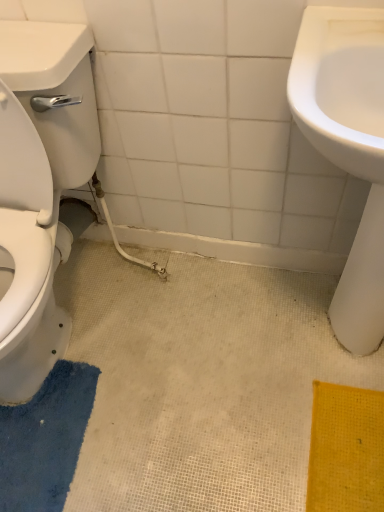
In the scene shown: Measure the distance between white glossy toilet at left and camera.

white glossy toilet at left is 32.58 inches from camera.

Find the location of a particular element. The image size is (384, 512). white glossy sink at right is located at coordinates (348, 147).

Where is `blue textured bath mat at lower left`? blue textured bath mat at lower left is located at coordinates (45, 439).

Where is `white glossy toilet at left`? white glossy toilet at left is located at coordinates (47, 196).

Considering the relative sizes of white glossy toilet at left and white glossy sink at right in the image provided, is white glossy toilet at left bigger than white glossy sink at right?

Correct, white glossy toilet at left is larger in size than white glossy sink at right.

What's the angular difference between white glossy toilet at left and white glossy sink at right's facing directions?

The angle between the facing direction of white glossy toilet at left and the facing direction of white glossy sink at right is 0.386 degrees.

Is the position of white glossy toilet at left more distant than that of white glossy sink at right?

That is False.

From a real-world perspective, relative to white glossy sink at right, is white glossy toilet at left vertically above or below?

white glossy toilet at left is situated higher than white glossy sink at right in the real world.

Is the surface of white glossy toilet at left in direct contact with blue textured bath mat at lower left?

No, white glossy toilet at left is not in contact with blue textured bath mat at lower left.

Where is `bath mat on the right of the white glossy toilet at left`? The height and width of the screenshot is (512, 384). bath mat on the right of the white glossy toilet at left is located at coordinates (45, 439).

In the scene shown: How far apart are white glossy toilet at left and blue textured bath mat at lower left?

white glossy toilet at left and blue textured bath mat at lower left are 12.08 inches apart.

Is white glossy toilet at left positioned beyond the bounds of blue textured bath mat at lower left?

white glossy toilet at left is positioned outside blue textured bath mat at lower left.

Would you say white glossy toilet at left is part of white glossy sink at right's contents?

No.

Which is nearer, (382, 290) or (77, 104)?

Point (77, 104)

Does white glossy sink at right appear on the right side of white glossy toilet at left?

Yes, white glossy sink at right is to the right of white glossy toilet at left.

Between point (53, 429) and point (320, 65), which one is positioned behind?

Positioned behind is point (53, 429).

Is blue textured bath mat at lower left oriented away from white glossy sink at right?

No, blue textured bath mat at lower left is not facing the opposite direction of white glossy sink at right.

Where is `bath mat that is below the white glossy sink at right (from the image's perspective)`? This screenshot has height=512, width=384. bath mat that is below the white glossy sink at right (from the image's perspective) is located at coordinates (45, 439).

Based on the photo, is blue textured bath mat at lower left far away from white glossy sink at right?

That's not correct — blue textured bath mat at lower left is a little close to white glossy sink at right.

From the image's perspective, which is below, blue textured bath mat at lower left or white glossy toilet at left?

blue textured bath mat at lower left, from the image's perspective.

Consider the image. What's the angular difference between blue textured bath mat at lower left and white glossy toilet at left's facing directions?

6.98 degrees separate the facing orientations of blue textured bath mat at lower left and white glossy toilet at left.

Is blue textured bath mat at lower left oriented away from white glossy toilet at left?

No, blue textured bath mat at lower left's orientation is not away from white glossy toilet at left.

Can you see blue textured bath mat at lower left touching white glossy toilet at left?

No, blue textured bath mat at lower left is not next to white glossy toilet at left.

Consider the image. Is white glossy sink at right oriented away from blue textured bath mat at lower left?

No, white glossy sink at right is not facing the opposite direction of blue textured bath mat at lower left.

Locate an element on the screen. This screenshot has width=384, height=512. sink above the blue textured bath mat at lower left (from a real-world perspective) is located at coordinates (348, 147).

In the scene shown: Based on their positions, is white glossy sink at right located to the left or right of blue textured bath mat at lower left?

Clearly, white glossy sink at right is on the right of blue textured bath mat at lower left in the image.

Locate an element on the screen. sink to the right of white glossy toilet at left is located at coordinates (348, 147).

Where is `bath mat below the white glossy toilet at left (from the image's perspective)`? The image size is (384, 512). bath mat below the white glossy toilet at left (from the image's perspective) is located at coordinates (45, 439).

From the image, which object appears to be nearer to blue textured bath mat at lower left, white glossy sink at right or white glossy toilet at left?

The object closer to blue textured bath mat at lower left is white glossy toilet at left.

Looking at the image, which one is located further to white glossy sink at right, blue textured bath mat at lower left or white glossy toilet at left?

blue textured bath mat at lower left lies further to white glossy sink at right than the other object.

Based on their spatial positions, is white glossy toilet at left or white glossy sink at right closer to blue textured bath mat at lower left?

white glossy toilet at left is positioned closer to the anchor blue textured bath mat at lower left.

When comparing their distances from white glossy sink at right, does white glossy toilet at left or blue textured bath mat at lower left seem closer?

The object closer to white glossy sink at right is white glossy toilet at left.

From the image, which object appears to be nearer to white glossy toilet at left, white glossy sink at right or blue textured bath mat at lower left?

blue textured bath mat at lower left is positioned closer to the anchor white glossy toilet at left.

Looking at the image, which one is located closer to white glossy toilet at left, blue textured bath mat at lower left or white glossy sink at right?

blue textured bath mat at lower left.

Find the location of a particular element. bath mat between white glossy toilet at left and white glossy sink at right in the horizontal direction is located at coordinates (45, 439).